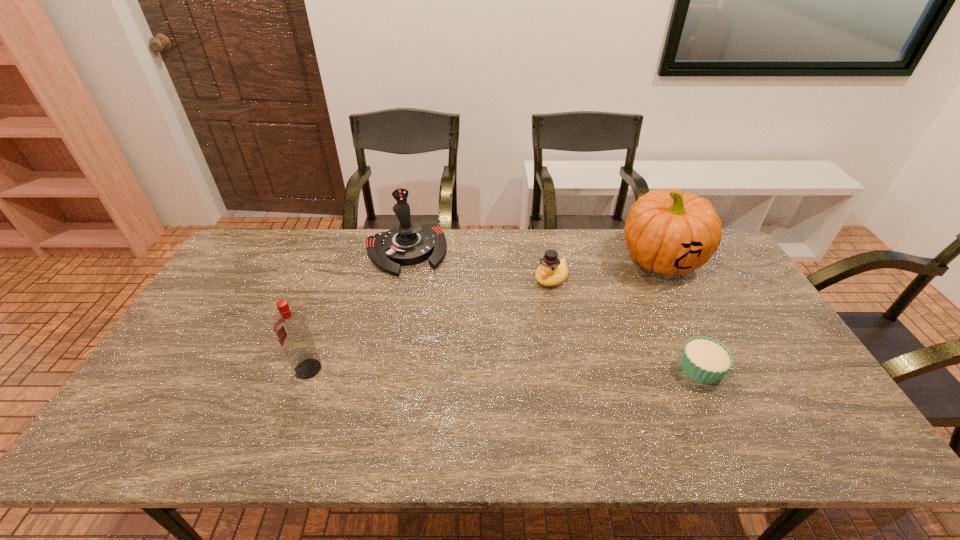
The image size is (960, 540). In the image, there is a desktop. Find the location of `vacant area at the near left corner`. vacant area at the near left corner is located at coordinates tap(180, 395).

Locate an element on the screen. free space at the near right corner of the desktop is located at coordinates (817, 394).

Locate an element on the screen. This screenshot has width=960, height=540. free space between the cupcake and the vodka is located at coordinates (504, 369).

Locate an element on the screen. Image resolution: width=960 pixels, height=540 pixels. empty space between the pumpkin and the leftmost object is located at coordinates (485, 314).

This screenshot has height=540, width=960. I want to click on free spot between the pumpkin and the leftmost object, so click(x=485, y=314).

You are a GUI agent. You are given a task and a screenshot of the screen. Output one action in this format:
    pyautogui.click(x=<x>, y=<y>)
    Task: Click on the free space between the shortest object and the joystick
    
    Given the screenshot: What is the action you would take?
    pyautogui.click(x=553, y=310)

Where is `free space between the joystick and the shortest object`? free space between the joystick and the shortest object is located at coordinates (553, 310).

Locate an element on the screen. The height and width of the screenshot is (540, 960). free space between the pumpkin and the shortest object is located at coordinates (682, 314).

Locate an element on the screen. vacant region between the duck and the pumpkin is located at coordinates (607, 269).

Locate an element on the screen. vacant space that is in between the pumpkin and the vodka is located at coordinates (485, 314).